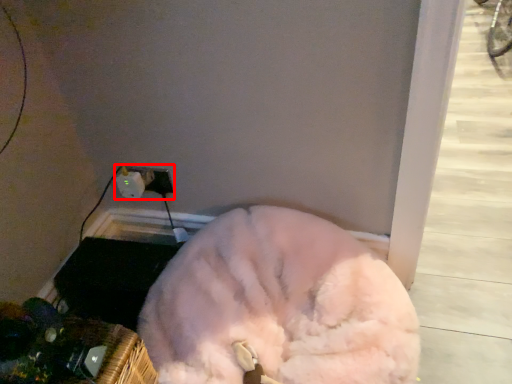
Question: From the image's perspective, where is electric outlet (annotated by the red box) located relative to dog?

Choices:
 (A) below
 (B) above

Answer: (B)